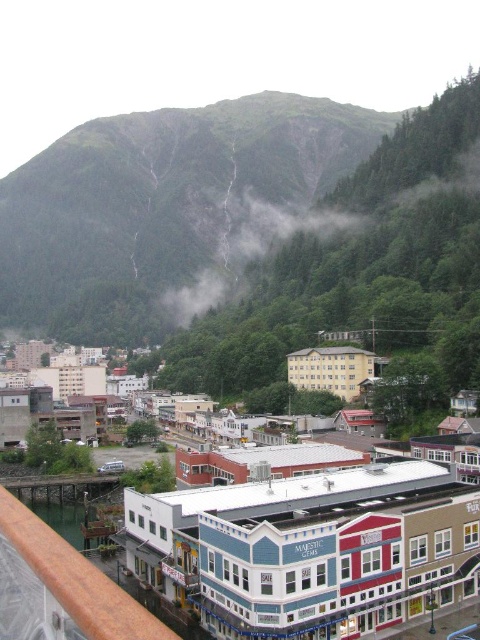
You are standing in the scenic town and want to take a photo of the multicolored painted building at center and the foggy misty cloud at center. Which object should you frame first in your camera viewfinder to ensure both are captured in the same shot?

The foggy misty cloud at center should be framed first since the multicolored painted building at center is positioned on the right side of it, meaning the building is to the right of the cloud. By centering the cloud first, you can adjust the camera to include the building on the right side in the same frame.

You are a tourist standing at the edge of the town looking towards the mountain. You see the multicolored painted building at center and the foggy misty cloud at center. Which object appears larger in the scene?

The foggy misty cloud at center appears larger than the multicolored painted building at center in the scene.

You are a tourist standing at the edge of the town and want to take a photo that includes both the multicolored painted building at center and the foggy misty cloud at center. Given that your camera has a maximum focus range of 200 meters, will you be able to capture both objects in sharp focus in a single shot?

The multicolored painted building at center and foggy misty cloud at center are 238.48 meters apart. Since the distance between them exceeds the camera maximum focus range of 200 meters, you cannot capture both objects in sharp focus in a single shot.